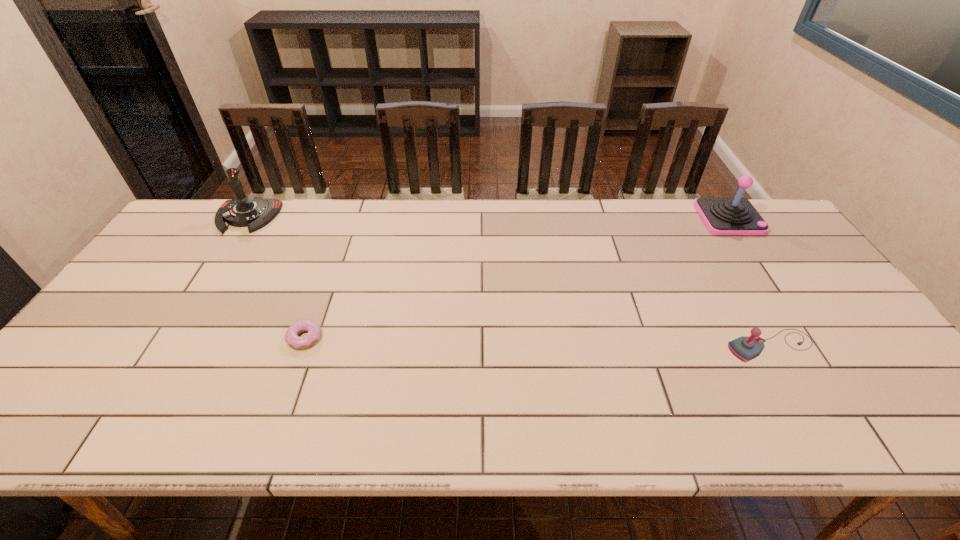
Identify which object is the third nearest to the leftmost object. Please provide its 2D coordinates. Your answer should be formatted as a tuple, i.e. [(x, y)], where the tuple contains the x and y coordinates of a point satisfying the conditions above.

[(736, 215)]

I want to click on object that is the third nearest to the second object from left to right, so click(736, 215).

Identify which joystick is located as the nearest to the leftmost joystick. Please provide its 2D coordinates. Your answer should be formatted as a tuple, i.e. [(x, y)], where the tuple contains the x and y coordinates of a point satisfying the conditions above.

[(745, 348)]

Locate an element on the screen. The image size is (960, 540). the second closest joystick to the nearest joystick is located at coordinates (244, 210).

Find the location of a particular element. This screenshot has width=960, height=540. free space that satisfies the following two spatial constraints: 1. on the handle side of the third object from right to left; 2. on the right side of the leftmost object is located at coordinates (170, 338).

Locate an element on the screen. The image size is (960, 540). blank space that satisfies the following two spatial constraints: 1. on the handle side of the leftmost object; 2. on the right side of the shortest object is located at coordinates (170, 338).

At what (x,y) coordinates should I click in order to perform the action: click on blank space that satisfies the following two spatial constraints: 1. on the handle side of the leftmost joystick; 2. on the left side of the third object from right to left. Please return your answer as a coordinate pair (x, y). Image resolution: width=960 pixels, height=540 pixels. Looking at the image, I should click on (170, 338).

Image resolution: width=960 pixels, height=540 pixels. In order to click on vacant space that satisfies the following two spatial constraints: 1. on the handle side of the second object from left to right; 2. on the left side of the leftmost joystick in this screenshot , I will do `click(170, 338)`.